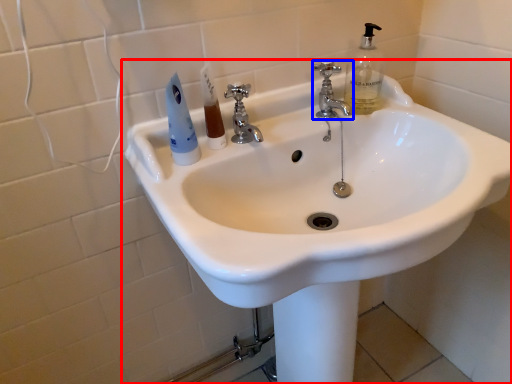
Question: Which of the following is the closest to the observer, sink (highlighted by a red box) or tap (highlighted by a blue box)?

Choices:
 (A) sink
 (B) tap

Answer: (A)